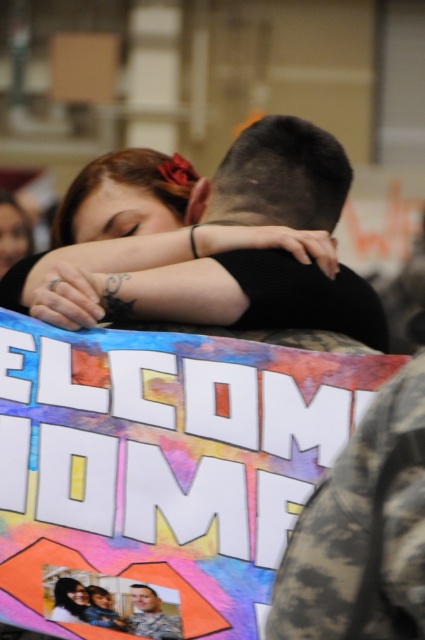
You are a photographer at a welcome home event. You need to capture a photo of the dark brown hair at upper center and the camouflage uniform at center. Based on their positions, which object is located to the right of the other?

The dark brown hair at upper center is positioned on the right side of camouflage uniform at center, so the dark brown hair at upper center is to the right of the camouflage uniform at center.

You are a photographer at a welcome home event. You need to arrange the subjects so that the camouflage uniform at center and the matte black hair at upper left are visible in the frame. Based on their positions, which one should be placed closer to the right side of the camera frame?

The camouflage uniform at center should be placed closer to the right side of the camera frame because it is positioned on the right side of the matte black hair at upper left.

You are a photographer at the Welcome Home event. You need to adjust your camera focus to capture both the dark brown hair at upper center and the camouflage uniform at center clearly. Which object should you focus on first to ensure both are in focus?

The dark brown hair at upper center is positioned over the camouflage uniform at center, so you should focus on the dark brown hair at upper center first to ensure both are in focus.